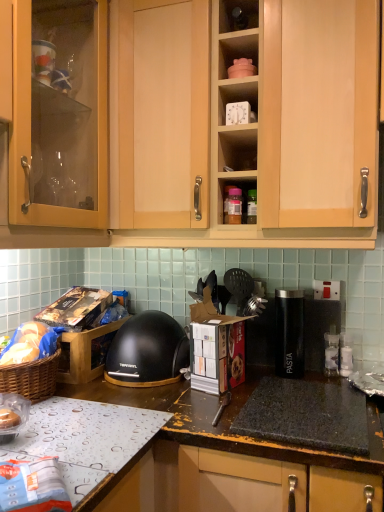
Question: Is white plastic clock at upper center, the 2th shelf from the top, taller or shorter than black matte helmet at center?

Choices:
 (A) tall
 (B) short

Answer: (B)

Question: Is point (238, 82) positioned closer to the camera than point (158, 362)?

Choices:
 (A) closer
 (B) farther

Answer: (A)

Question: Estimate the real-world distances between objects in this image. Which object is farther from the matte plastic container at upper center, the first shelf positioned from the top?

Choices:
 (A) clear plastic bag at lower left
 (B) black matte helmet at center
 (C) white plastic clock at upper center, the first shelf in the bottom-to-top sequence
 (D) black granite gas stove at lower center
 (E) black plastic pasta container at center

Answer: (A)

Question: Estimate the real-world distances between objects in this image. Which object is farther from the metallic silver tray at lower left?

Choices:
 (A) clear plastic bag at lower left
 (B) black matte helmet at center
 (C) white plastic clock at upper center, the first shelf in the bottom-to-top sequence
 (D) matte plastic container at upper center, the first shelf positioned from the top
 (E) light wood cabinet at upper center

Answer: (D)